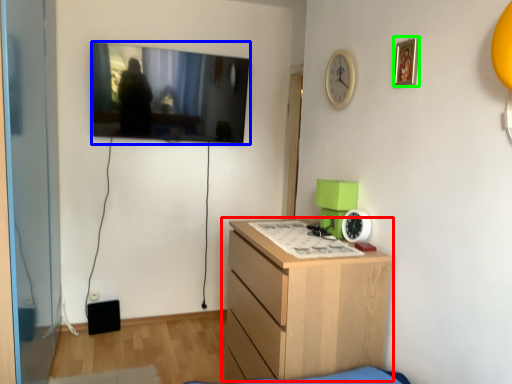
Question: Considering the real-world distances, which object is farthest from chest of drawers (highlighted by a red box)? television (highlighted by a blue box) or picture frame (highlighted by a green box)?

Choices:
 (A) television
 (B) picture frame

Answer: (A)